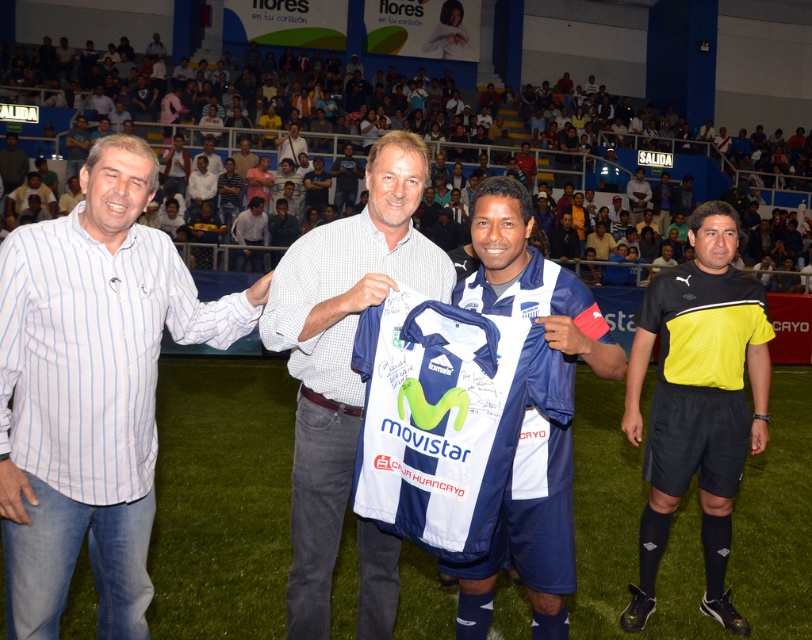
You are a photographer at the event and want to ensure both the white checkered shirt at center and the white jersey at center are clearly visible in your photo. Given their sizes, which one might you need to position closer to the camera to maintain clarity?

The white checkered shirt at center is larger in size than the white jersey at center, so you can position the white jersey at center closer to the camera to ensure both are clearly visible.

You are a photographer trying to capture the white checkered shirt at center in the image. Based on the coordinates provided, where would you aim your camera to ensure the shirt is centered in your shot?

You should aim your camera at the coordinates point (340, 353) to center the white checkered shirt at center in your shot.

You are a photographer at the event and need to capture a photo where both the white fabric jersey at center and the white jersey at center are clearly visible. Based on their positions, which jersey should be placed on the left side of the photo to ensure both are visible?

The white jersey at center should be placed on the left side of the photo because the white fabric jersey at center is to the right of it, ensuring both are visible in the frame.